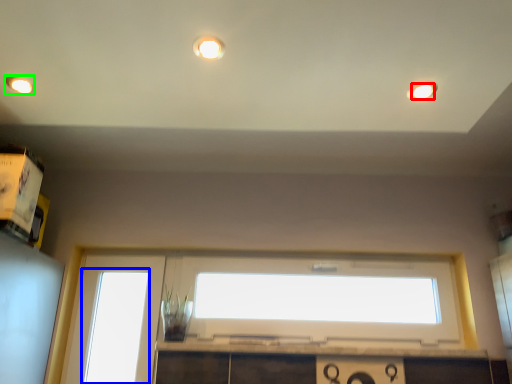
Question: Based on their relative distances, which object is nearer to lighting (highlighted by a red box)? Choose from window (highlighted by a blue box) and lighting (highlighted by a green box).

Choices:
 (A) window
 (B) lighting

Answer: (B)